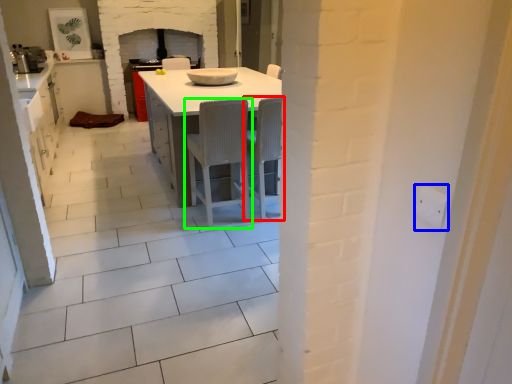
Question: Considering the real-world distances, which object is closest to chair (highlighted by a red box)? electric outlet (highlighted by a blue box) or chair (highlighted by a green box).

Choices:
 (A) electric outlet
 (B) chair

Answer: (B)